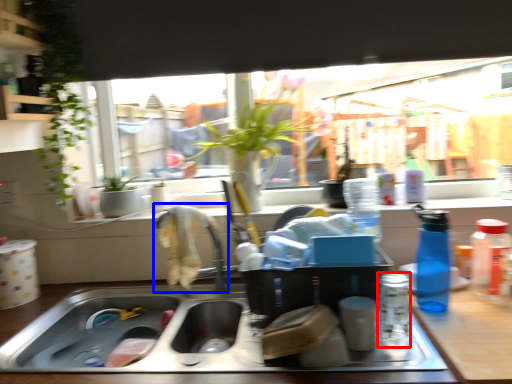
Question: Which point is further to the camera, bottle (highlighted by a red box) or faucet (highlighted by a blue box)?

Choices:
 (A) bottle
 (B) faucet

Answer: (B)